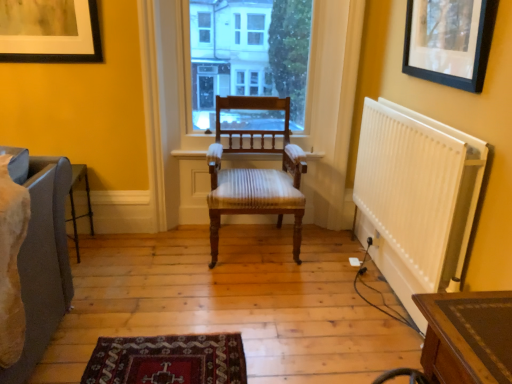
Where is `free spot to the left of white plastic radiator at right`? The width and height of the screenshot is (512, 384). free spot to the left of white plastic radiator at right is located at coordinates (279, 298).